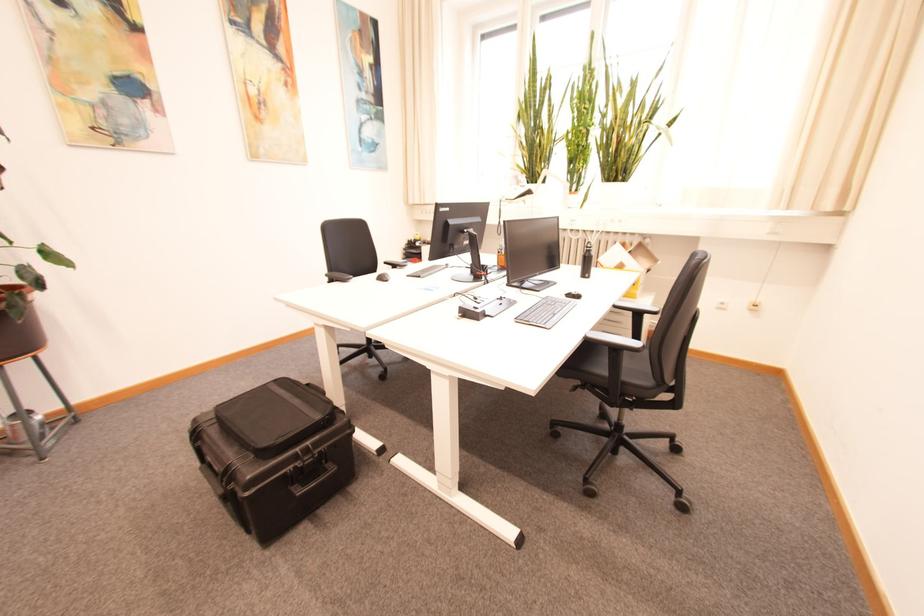
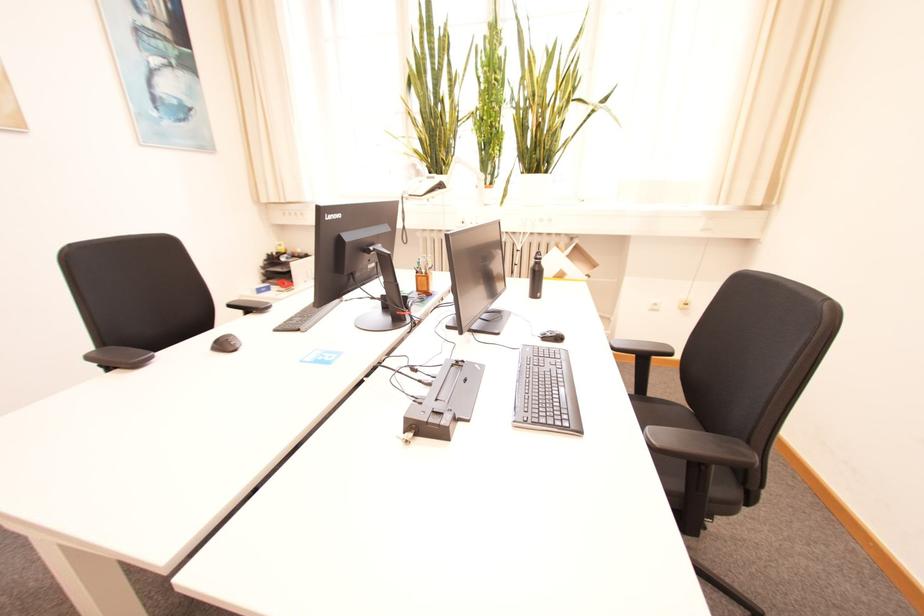
The point at (530, 187) is marked in the first image. Where is the corresponding point in the second image?

(440, 177)